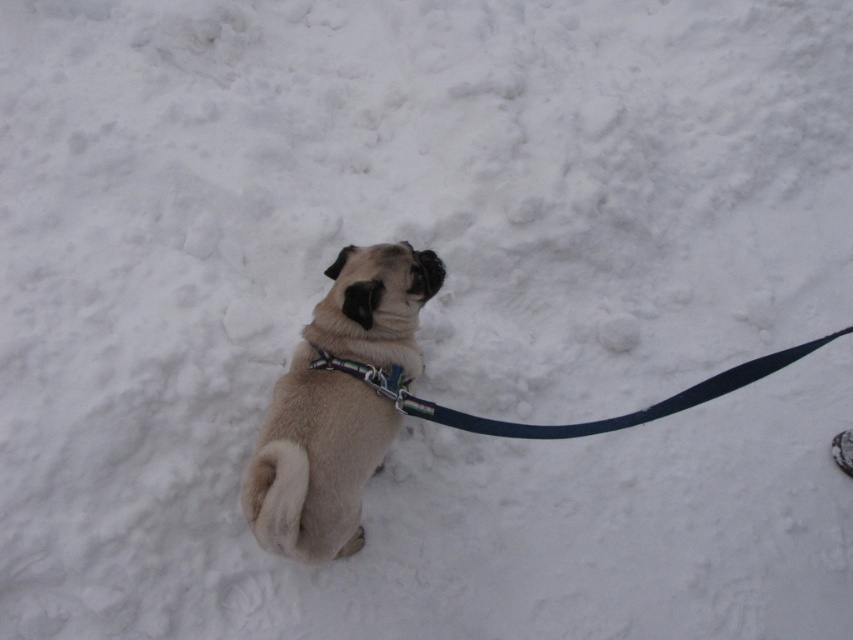
Between beige fur dog at center and metallic chain at center, which one is positioned lower?

beige fur dog at center

Image resolution: width=853 pixels, height=640 pixels. I want to click on beige fur dog at center, so click(x=337, y=404).

Between black nylon leash at center and metallic chain at center, which one has less height?

metallic chain at center is shorter.

Is black nylon leash at center to the left of metallic chain at center from the viewer's perspective?

Incorrect, black nylon leash at center is not on the left side of metallic chain at center.

Looking at this image, who is more forward, (780,352) or (317,353)?

Point (317,353) is more forward.

Where is `black nylon leash at center`? This screenshot has height=640, width=853. black nylon leash at center is located at coordinates (561, 424).

Consider the image. Who is positioned more to the right, beige fur dog at center or black nylon leash at center?

From the viewer's perspective, black nylon leash at center appears more on the right side.

Can you confirm if beige fur dog at center is positioned to the left of black nylon leash at center?

Indeed, beige fur dog at center is positioned on the left side of black nylon leash at center.

Is point (305, 362) positioned before point (567, 433)?

That is False.

Find the location of a particular element. This screenshot has height=640, width=853. beige fur dog at center is located at coordinates (337, 404).